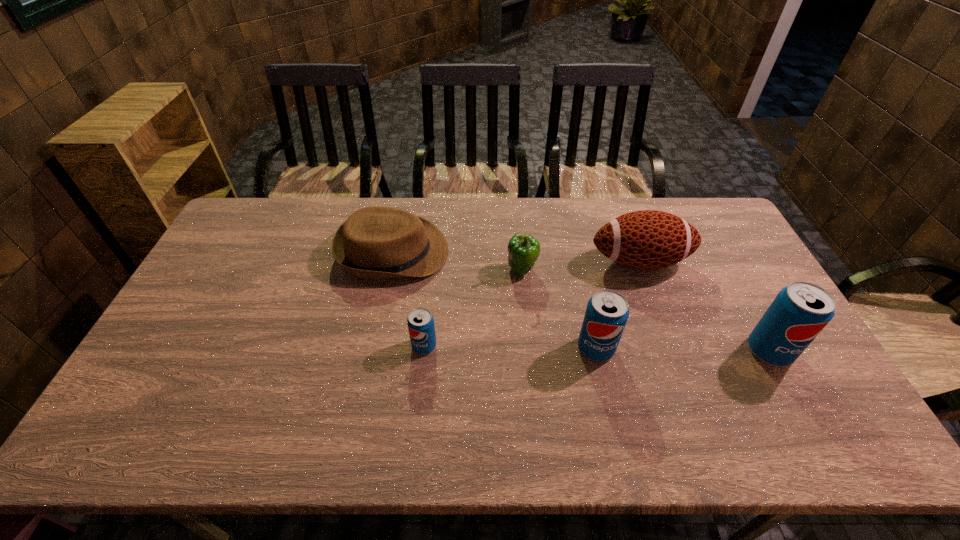
Identify the location of the leftmost soda can. The height and width of the screenshot is (540, 960). point(420,321).

Image resolution: width=960 pixels, height=540 pixels. What are the coordinates of `the second tallest soda can` in the screenshot? It's located at (607, 312).

At what (x,y) coordinates should I click in order to perform the action: click on the rightmost soda can. Please return your answer as a coordinate pair (x, y). Looking at the image, I should click on (800, 311).

The image size is (960, 540). Identify the location of bell pepper. (523, 250).

Identify the location of fedora. (376, 242).

You are a GUI agent. You are given a task and a screenshot of the screen. Output one action in this format:
    pyautogui.click(x=<x>, y=<y>)
    Task: Click on the football
    
    Given the screenshot: What is the action you would take?
    pyautogui.click(x=648, y=239)

I want to click on vacant space situated on the back of the shortest soda can, so click(435, 241).

Where is `free location located on the left of the second soda can from right to left`? free location located on the left of the second soda can from right to left is located at coordinates (453, 348).

Where is `vacant area located 0.220m on the left of the rightmost object`? The height and width of the screenshot is (540, 960). vacant area located 0.220m on the left of the rightmost object is located at coordinates (666, 351).

Identify the location of vacant space located on the back of the fourth object from right to left. (518, 226).